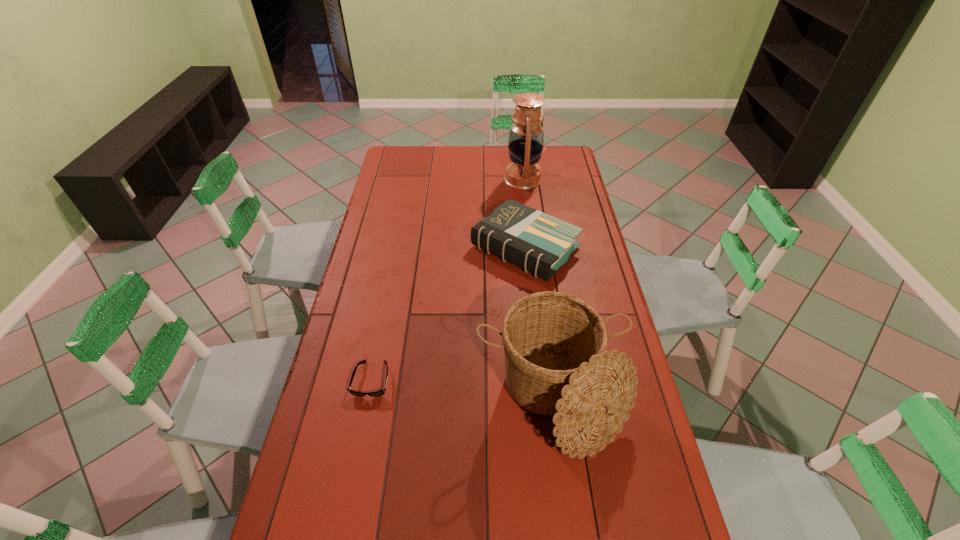
Where is `free region located on the front-facing side of the leftmost object`? This screenshot has height=540, width=960. free region located on the front-facing side of the leftmost object is located at coordinates (343, 526).

Find the location of a particular element. This screenshot has width=960, height=540. object present at the far edge is located at coordinates (526, 137).

Where is `object at the left edge`? The image size is (960, 540). object at the left edge is located at coordinates (378, 393).

Image resolution: width=960 pixels, height=540 pixels. I want to click on basket located at the right edge, so click(x=556, y=362).

Locate an element on the screen. The height and width of the screenshot is (540, 960). paperback book located in the right edge section of the desktop is located at coordinates (539, 243).

Where is `vacant area at the far edge of the desktop`? The height and width of the screenshot is (540, 960). vacant area at the far edge of the desktop is located at coordinates (484, 159).

In the image, there is a desktop. Where is `vacant space at the left edge`? vacant space at the left edge is located at coordinates (356, 291).

Where is `free spot at the right edge of the desktop`? Image resolution: width=960 pixels, height=540 pixels. free spot at the right edge of the desktop is located at coordinates (618, 520).

The width and height of the screenshot is (960, 540). I want to click on vacant area that lies between the paperback book and the leftmost object, so pos(448,314).

At what (x,y) coordinates should I click in order to perform the action: click on vacant region between the sunglasses and the tallest object. Please return your answer as a coordinate pair (x, y). This screenshot has height=540, width=960. Looking at the image, I should click on (447, 279).